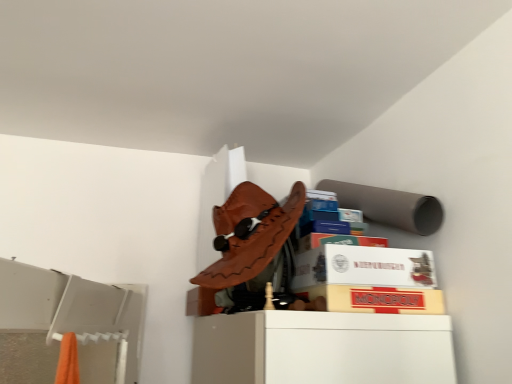
Question: In the image, is matte yellow monopoly box at center, the 1th cardboard box positioned from the bottom, on the left side or the right side of white cardboard box at upper center, the second cardboard box when ordered from bottom to top?

Choices:
 (A) right
 (B) left

Answer: (A)

Question: Is point (414, 299) positioned closer to the camera than point (393, 254)?

Choices:
 (A) closer
 (B) farther

Answer: (A)

Question: Is matte yellow monopoly box at center, the 1th cardboard box positioned from the bottom, bigger or smaller than white cardboard box at upper center, the second cardboard box when ordered from bottom to top?

Choices:
 (A) big
 (B) small

Answer: (B)

Question: Looking at their shapes, would you say white cardboard box at upper center, the 1th cardboard box from the top, is wider or thinner than matte yellow monopoly box at center, the second cardboard box from the top?

Choices:
 (A) wide
 (B) thin

Answer: (B)

Question: Based on their sizes in the image, would you say white cardboard box at upper center, the 1th cardboard box from the top, is bigger or smaller than matte yellow monopoly box at center, the second cardboard box from the top?

Choices:
 (A) big
 (B) small

Answer: (A)

Question: Does point (300, 274) appear closer or farther from the camera than point (368, 296)?

Choices:
 (A) farther
 (B) closer

Answer: (A)

Question: From the image's perspective, is white cardboard box at upper center, the second cardboard box when ordered from bottom to top, above or below matte yellow monopoly box at center, the second cardboard box from the top?

Choices:
 (A) above
 (B) below

Answer: (A)